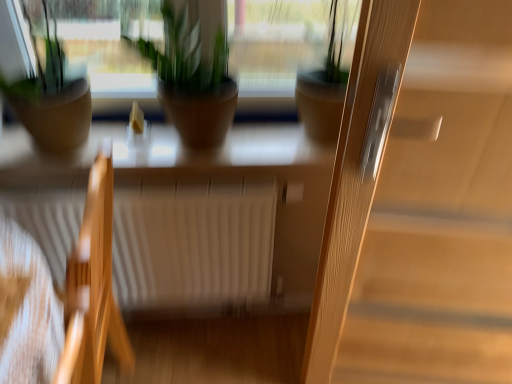
Where is `empty space that is ontop of white matte radiator at center (from a real-world perspective)`? The height and width of the screenshot is (384, 512). empty space that is ontop of white matte radiator at center (from a real-world perspective) is located at coordinates (160, 185).